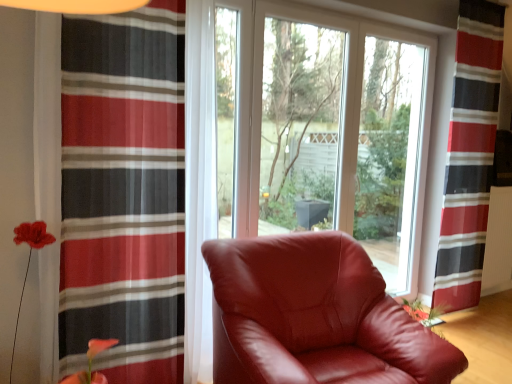
Question: From a real-world perspective, is satin burgundy armchair at center positioned above or below white textured radiator at right?

Choices:
 (A) above
 (B) below

Answer: (B)

Question: Considering the positions of satin burgundy armchair at center and white textured radiator at right in the image, is satin burgundy armchair at center wider or thinner than white textured radiator at right?

Choices:
 (A) thin
 (B) wide

Answer: (B)

Question: Estimate the real-world distances between objects in this image. Which object is closer to the satin burgundy armchair at center?

Choices:
 (A) red striped curtain at right, the 2th curtain when ordered from front to back
 (B) striped sheer curtain at left, which ranks as the first curtain in front-to-back order
 (C) white textured radiator at right
 (D) transparent glass window at center

Answer: (B)

Question: Which object is positioned farthest from the red striped curtain at right, the 1th curtain viewed from the right?

Choices:
 (A) striped sheer curtain at left, which ranks as the first curtain in front-to-back order
 (B) satin burgundy armchair at center
 (C) transparent glass window at center
 (D) white textured radiator at right

Answer: (A)